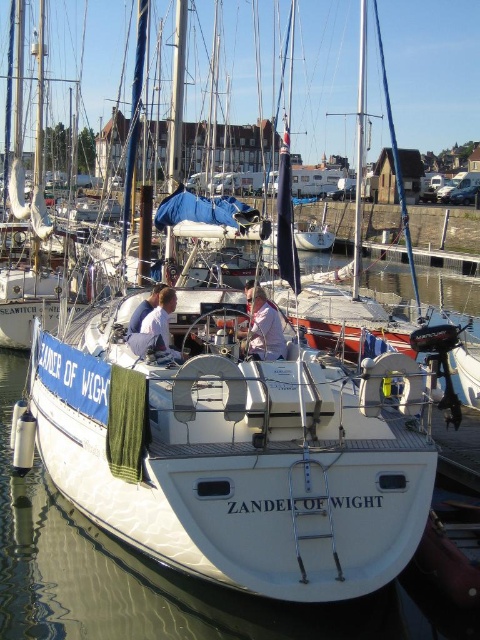
Does pink fabric at center have a greater height compared to white fabric shirt at center?

Yes, pink fabric at center is taller than white fabric shirt at center.

Is point (252, 355) positioned behind point (182, 355)?

No, it is not.

Locate an element on the screen. Image resolution: width=480 pixels, height=640 pixels. pink fabric at center is located at coordinates (263, 326).